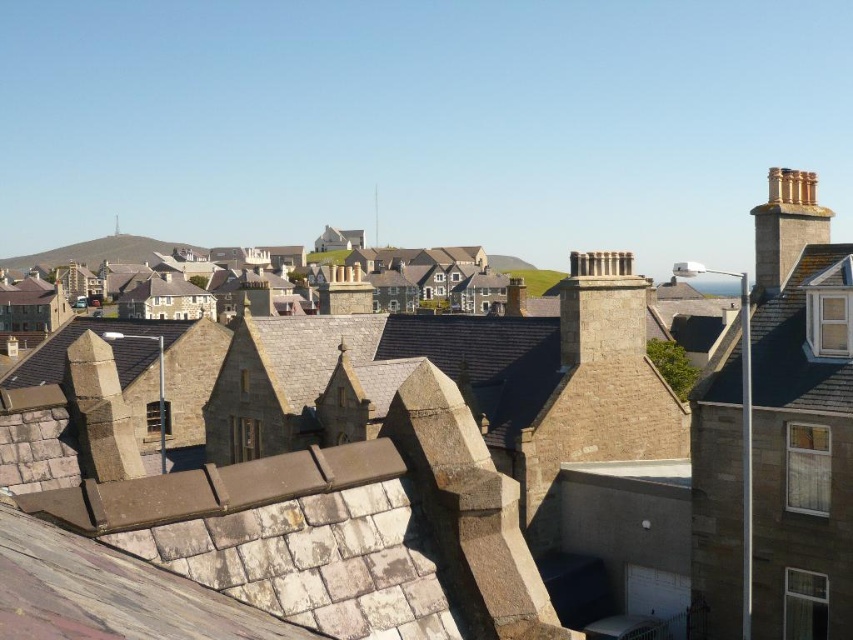
Is brown stone rooftops at center closer to camera compared to brown stone roof at upper right?

Yes, it is in front of brown stone roof at upper right.

Which is below, brown stone rooftops at center or brown stone roof at upper right?

brown stone rooftops at center is below.

Measure the distance between point (x=160, y=477) and camera.

Point (x=160, y=477) is 19.52 meters from camera.

Identify the location of brown stone rooftops at center. The width and height of the screenshot is (853, 640). (405, 464).

Who is more forward, (850, 406) or (775, 216)?

Point (850, 406)

Is point (827, 308) behind point (827, 212)?

No, it is in front of (827, 212).

Locate an element on the screen. The width and height of the screenshot is (853, 640). brown stone roof at upper right is located at coordinates (805, 336).

Does brown stone rooftops at center appear on the right side of golden stone chimney at upper right?

No, brown stone rooftops at center is not to the right of golden stone chimney at upper right.

Which is more to the right, brown stone rooftops at center or golden stone chimney at upper right?

Positioned to the right is golden stone chimney at upper right.

At what (x,y) coordinates should I click in order to perform the action: click on brown stone rooftops at center. Please return your answer as a coordinate pair (x, y). This screenshot has width=853, height=640. Looking at the image, I should click on (405, 464).

At what (x,y) coordinates should I click in order to perform the action: click on brown stone rooftops at center. Please return your answer as a coordinate pair (x, y). This screenshot has width=853, height=640. Looking at the image, I should click on (405, 464).